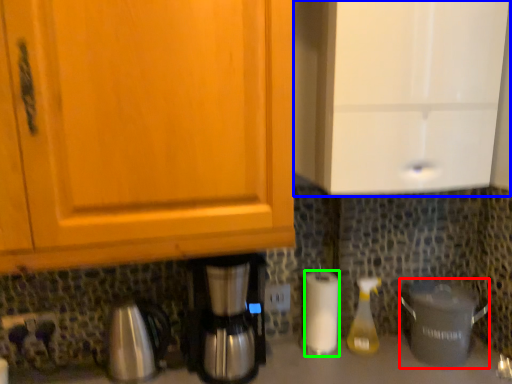
Question: Which is nearer to the crock pot (highlighted by a red box)? cabinetry (highlighted by a blue box) or paper towel (highlighted by a green box).

Choices:
 (A) cabinetry
 (B) paper towel

Answer: (B)